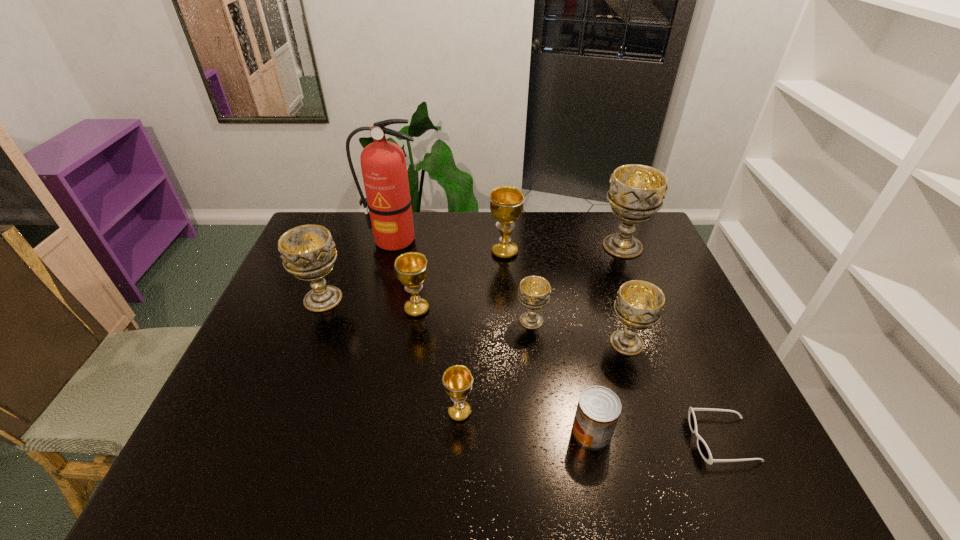
Image resolution: width=960 pixels, height=540 pixels. What are the coordinates of `vacant space located on the front of the third smallest white chalice` in the screenshot? It's located at (280, 411).

Where is `vacant area located on the front of the rightmost gold chalice`? This screenshot has width=960, height=540. vacant area located on the front of the rightmost gold chalice is located at coordinates (506, 276).

Where is `free space located on the back of the second smallest white chalice`? This screenshot has width=960, height=540. free space located on the back of the second smallest white chalice is located at coordinates (610, 291).

You are a GUI agent. You are given a task and a screenshot of the screen. Output one action in this format:
    pyautogui.click(x=<x>, y=<y>)
    Task: Click on the vacant region located on the right of the leftmost gold chalice
    
    Given the screenshot: What is the action you would take?
    pyautogui.click(x=557, y=309)

The width and height of the screenshot is (960, 540). Find the location of `vacant region located 0.300m on the back of the smallest white chalice`. vacant region located 0.300m on the back of the smallest white chalice is located at coordinates (522, 248).

Where is `free spot located on the back of the second gold chalice from right to left`? Image resolution: width=960 pixels, height=540 pixels. free spot located on the back of the second gold chalice from right to left is located at coordinates (462, 366).

What are the coordinates of `vacant space located 0.100m on the back of the fourth object from right to left` in the screenshot? It's located at (581, 380).

At what (x,y) coordinates should I click in order to perform the action: click on free location located with the lenses of the shortest object facing outward. Please return your answer as a coordinate pair (x, y). Looking at the image, I should click on (634, 440).

Where is `vacant space located 0.400m with the lenses of the shortest object facing outward`? Image resolution: width=960 pixels, height=540 pixels. vacant space located 0.400m with the lenses of the shortest object facing outward is located at coordinates (514, 440).

I want to click on free spot located with the lenses of the shortest object facing outward, so click(598, 440).